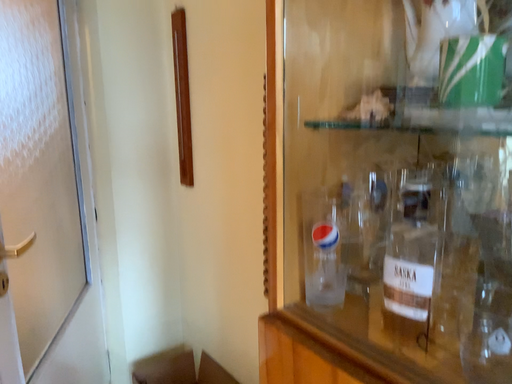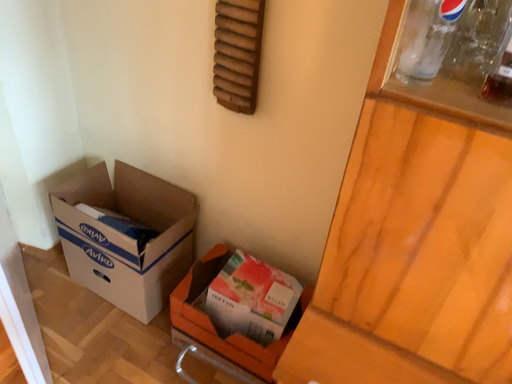
Question: How did the camera likely rotate when shooting the video?

Choices:
 (A) rotated right
 (B) rotated left

Answer: (A)